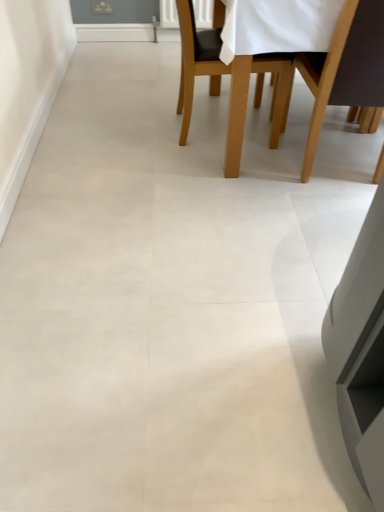
Find the location of a particular element. free space that is to the left of brown wood chair at upper right, the first chair positioned from the right is located at coordinates (263, 176).